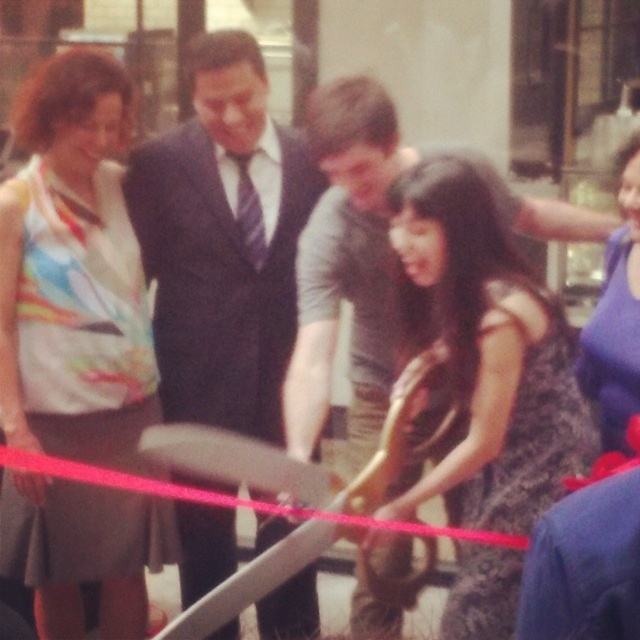
Which is in front, point (412, 289) or point (632, 186)?

Point (632, 186) is in front.

This screenshot has width=640, height=640. Describe the element at coordinates (484, 353) in the screenshot. I see `black lace dress at center` at that location.

Image resolution: width=640 pixels, height=640 pixels. I want to click on black lace dress at center, so click(x=484, y=353).

Find the location of `black lace dress at center`. black lace dress at center is located at coordinates (484, 353).

Can you confirm if dark blue suit at center is thinner than blue satin dress at lower right?

No.

Can you confirm if dark blue suit at center is taller than blue satin dress at lower right?

Yes, dark blue suit at center is taller than blue satin dress at lower right.

Locate an element on the screen. This screenshot has height=640, width=640. dark blue suit at center is located at coordinates (224, 241).

Is dark blue suit at center shorter than black lace dress at center?

No, dark blue suit at center is not shorter than black lace dress at center.

Does point (220, 243) come behind point (449, 397)?

Yes, it is behind point (449, 397).

I want to click on dark blue suit at center, so click(x=224, y=241).